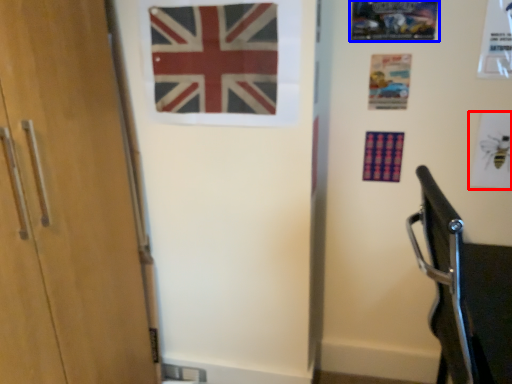
Question: Which object is further to the camera taking this photo, postcard (highlighted by a red box) or postcard (highlighted by a blue box)?

Choices:
 (A) postcard
 (B) postcard

Answer: (A)